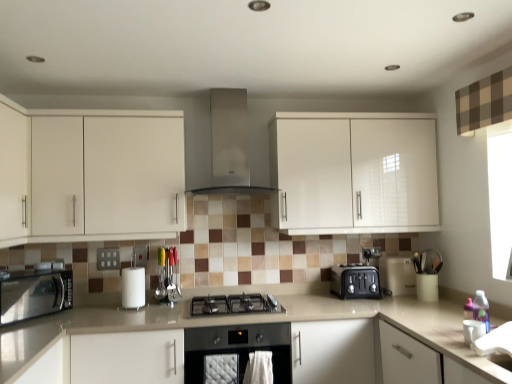
Question: Is point (193, 329) closer or farther from the camera than point (486, 362)?

Choices:
 (A) farther
 (B) closer

Answer: (A)

Question: From a real-world perspective, is stainless steel oven at center, the first home appliance ordered from the bottom, above or below beige laminate countertop at center?

Choices:
 (A) above
 (B) below

Answer: (B)

Question: Which object is positioned closest to the white glossy cabinet at upper center, which is counted as the 2th cabinetry, starting from the left?

Choices:
 (A) satin silver range hood at center, arranged as the first home appliance when viewed from the top
 (B) white glossy cabinet at upper left, the first cabinetry when ordered from left to right
 (C) matte white switch at center
 (D) black plastic toaster at lower center, positioned as the 1th kitchen appliance in back-to-front order
 (E) black plastic toaster at right

Answer: (A)

Question: Estimate the real-world distances between objects in this image. Which object is farther from the black plastic toaster at right?

Choices:
 (A) beige laminate countertop at center
 (B) satin silver range hood at center, which is the second home appliance in bottom-to-top order
 (C) black plastic toaster at lower center, marked as the second kitchen appliance in a left-to-right arrangement
 (D) brown checkered curtain at upper right
 (E) stainless steel oven at center, the first home appliance ordered from the bottom

Answer: (B)